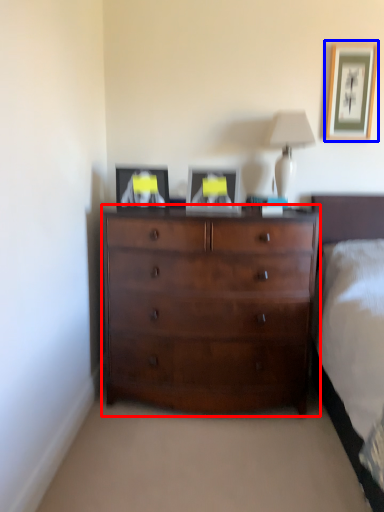
Question: Which object is closer to the camera taking this photo, chest of drawers (highlighted by a red box) or picture frame (highlighted by a blue box)?

Choices:
 (A) chest of drawers
 (B) picture frame

Answer: (A)